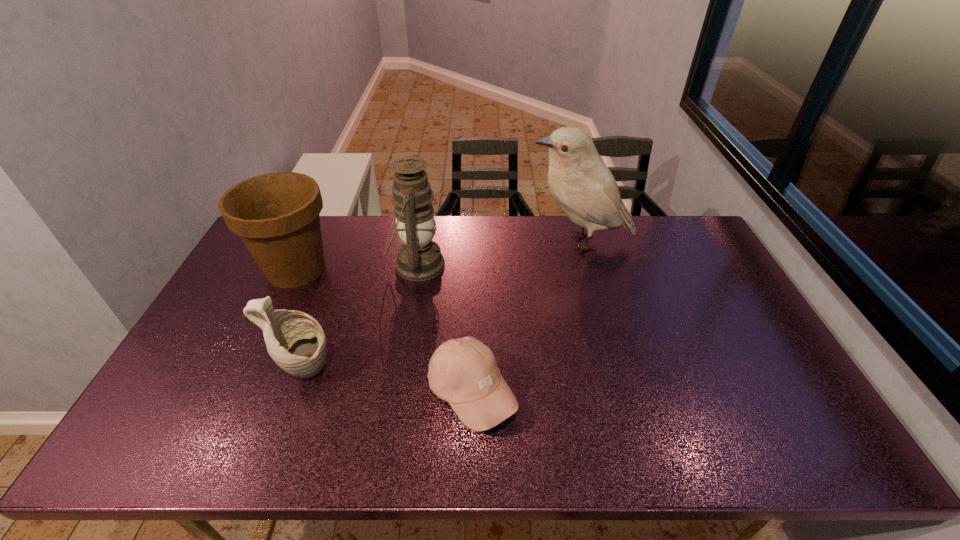
At what (x,y) coordinates should I click in order to perform the action: click on vacant space located 0.230m at the spout of the pitcher. Please return your answer as a coordinate pair (x, y). Image resolution: width=960 pixels, height=540 pixels. Looking at the image, I should click on pos(421,371).

Where is `vacant space located on the front-facing side of the shortest object`? vacant space located on the front-facing side of the shortest object is located at coordinates coord(603,393).

Identify the location of parakeet situated at the far edge. (585, 189).

Locate an element on the screen. Image resolution: width=960 pixels, height=540 pixels. oil lamp situated at the far edge is located at coordinates (419, 258).

What are the coordinates of `flowerpot that is at the far edge` in the screenshot? It's located at (276, 215).

Locate an element on the screen. This screenshot has width=960, height=540. object located in the near edge section of the desktop is located at coordinates (464, 372).

Locate an element on the screen. object that is at the left edge is located at coordinates (276, 215).

Where is `object at the far left corner`? The height and width of the screenshot is (540, 960). object at the far left corner is located at coordinates (276, 215).

At what (x,y) coordinates should I click in order to perform the action: click on free region at the far edge. Please return your answer as a coordinate pair (x, y). Looking at the image, I should click on (516, 215).

Where is `free region at the near edge of the desktop`? This screenshot has height=540, width=960. free region at the near edge of the desktop is located at coordinates (631, 444).